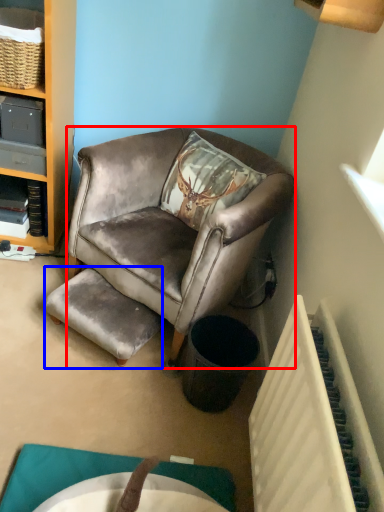
Question: Which object is closer to the camera taking this photo, chair (highlighted by a red box) or stool (highlighted by a blue box)?

Choices:
 (A) chair
 (B) stool

Answer: (A)